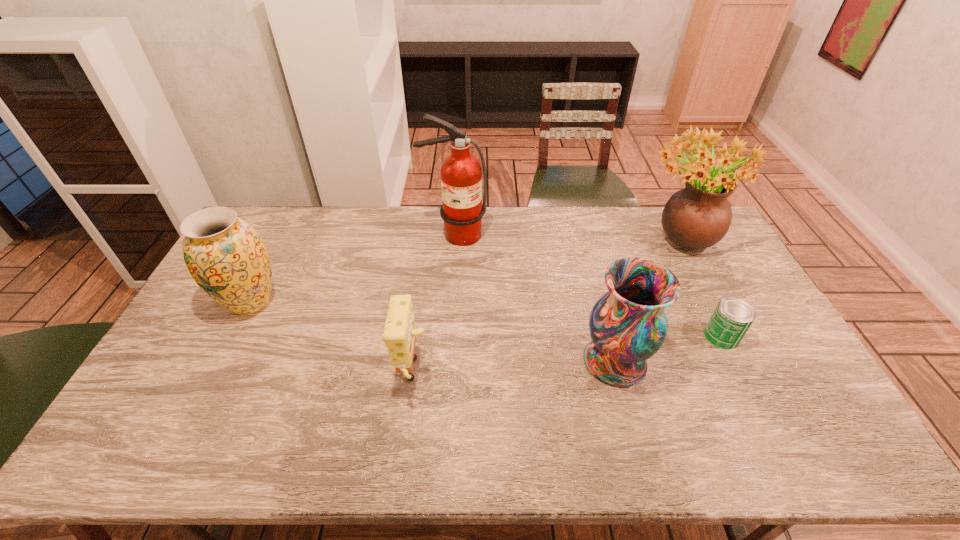
Where is `fire extinguisher`? Image resolution: width=960 pixels, height=540 pixels. fire extinguisher is located at coordinates (461, 174).

Identify the location of flower arrangement. (696, 217).

Find the location of a particular element. The image size is (960, 540). the left vase is located at coordinates tap(227, 258).

Locate an element on the screen. This screenshot has width=960, height=540. the leftmost object is located at coordinates (227, 258).

Find the location of a particular element. The width and height of the screenshot is (960, 540). the right vase is located at coordinates (628, 324).

I want to click on the third object from right to left, so click(628, 324).

Find the location of a particular element. The width and height of the screenshot is (960, 540). sponge is located at coordinates (399, 333).

Locate an element on the screen. The image size is (960, 540). the shortest object is located at coordinates (731, 319).

In order to click on free space located 0.180m on the nozzle and handle of the fire extinguisher in this screenshot , I will do `click(451, 283)`.

Where is `free space located on the left of the second tallest object`? free space located on the left of the second tallest object is located at coordinates (582, 240).